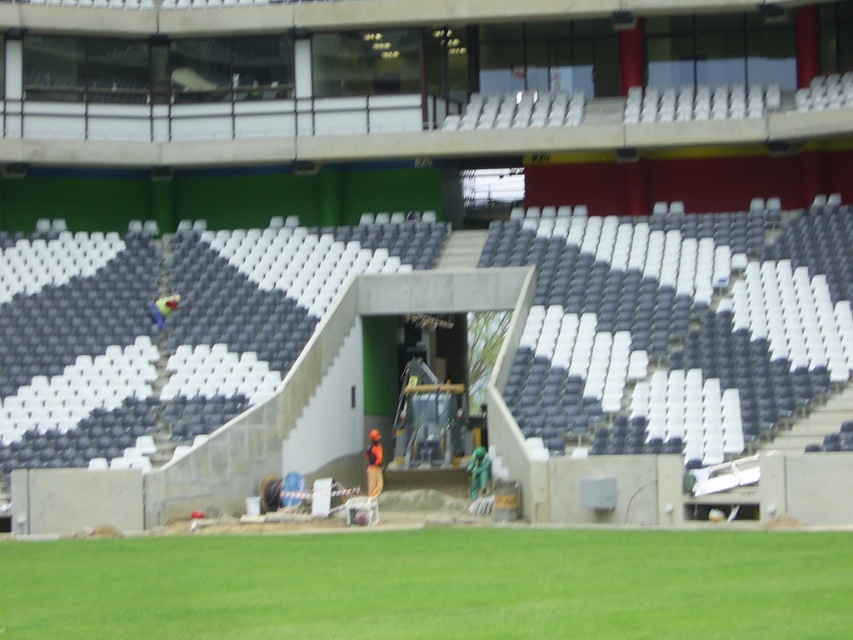
Can you confirm if concrete stairs at center is taller than green grass at lower center?

Yes, concrete stairs at center is taller than green grass at lower center.

Is concrete stairs at center behind green grass at lower center?

Yes, it is.

Does point (709, 413) lie in front of point (328, 570)?

No, (709, 413) is behind (328, 570).

Find the location of a particular element. This screenshot has width=853, height=640. concrete stairs at center is located at coordinates (490, 376).